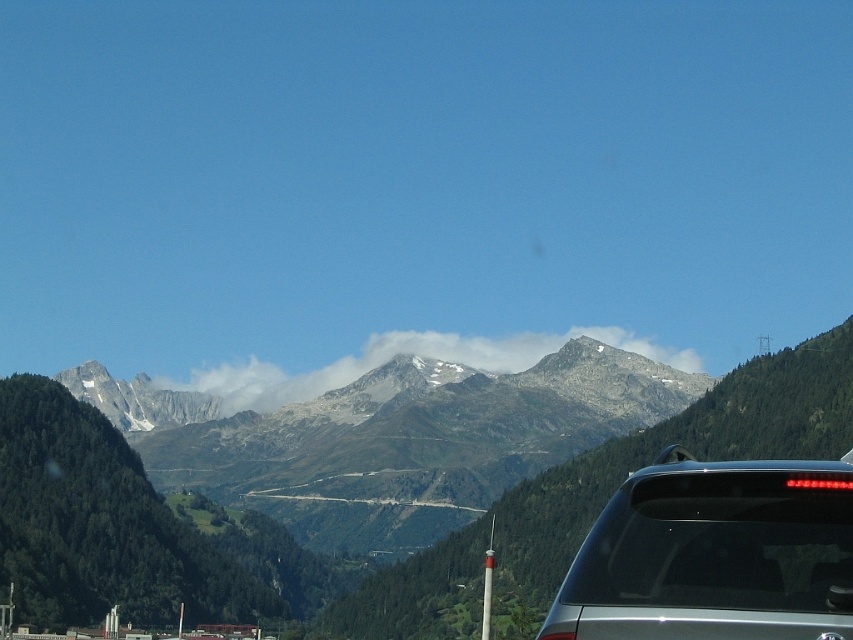
Question: Which object is positioned farthest from the gray rocky mountain range at center?

Choices:
 (A) white fluffy cloud at center
 (B) silver metallic car at lower right

Answer: (B)

Question: Which point is closer to the camera taking this photo?

Choices:
 (A) (412, 342)
 (B) (171, 605)
 (C) (730, 616)

Answer: (C)

Question: Which of the following is the closest to the observer?

Choices:
 (A) (149, 531)
 (B) (637, 616)

Answer: (B)

Question: In this image, where is silver metallic car at lower right located relative to white fluffy cloud at center?

Choices:
 (A) below
 (B) above

Answer: (A)

Question: In this image, where is silver metallic car at lower right located relative to white fluffy cloud at center?

Choices:
 (A) below
 (B) above

Answer: (A)

Question: Does gray rocky mountain range at center have a lesser width compared to silver metallic car at lower right?

Choices:
 (A) no
 (B) yes

Answer: (A)